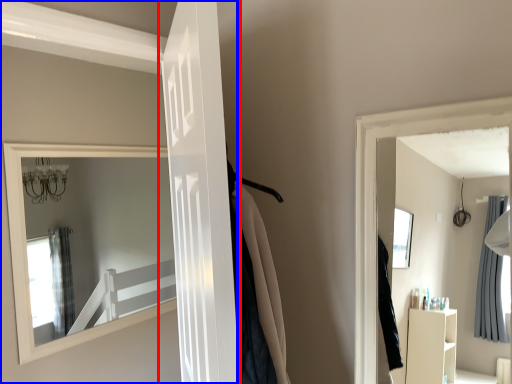
Question: Which object is closer to the camera taking this photo, door (highlighted by a red box) or door (highlighted by a blue box)?

Choices:
 (A) door
 (B) door

Answer: (A)